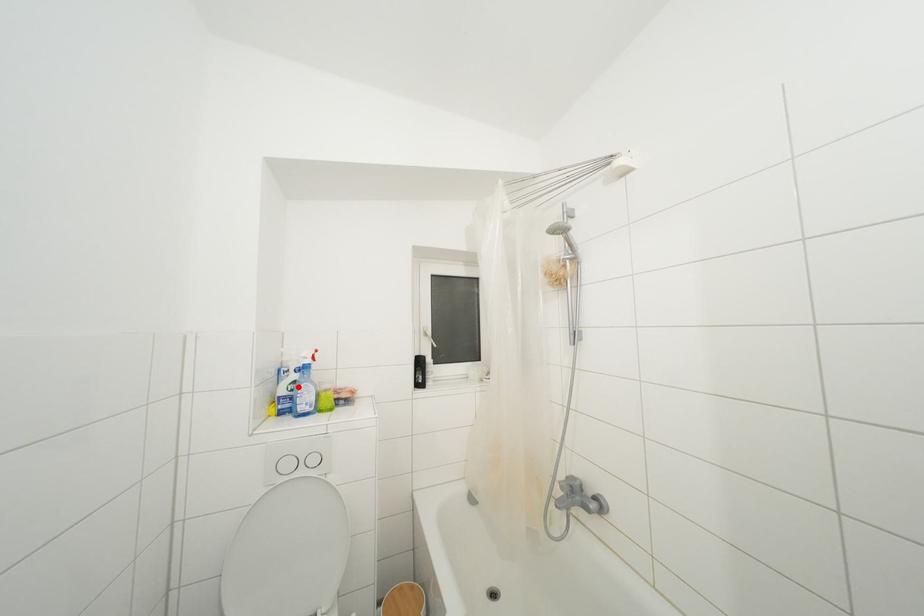
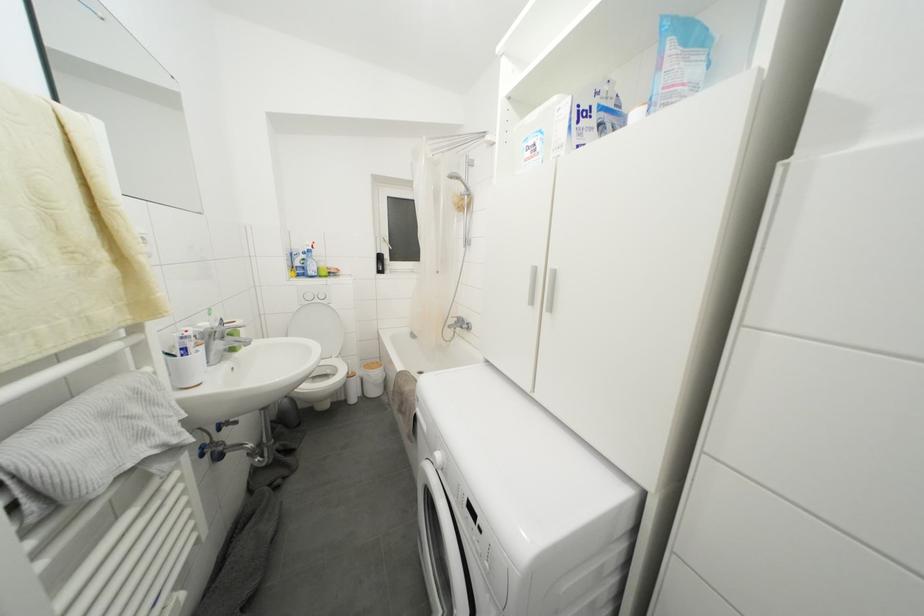
Find the pixel in the second image that matches the highlighted location in the first image.

(308, 264)